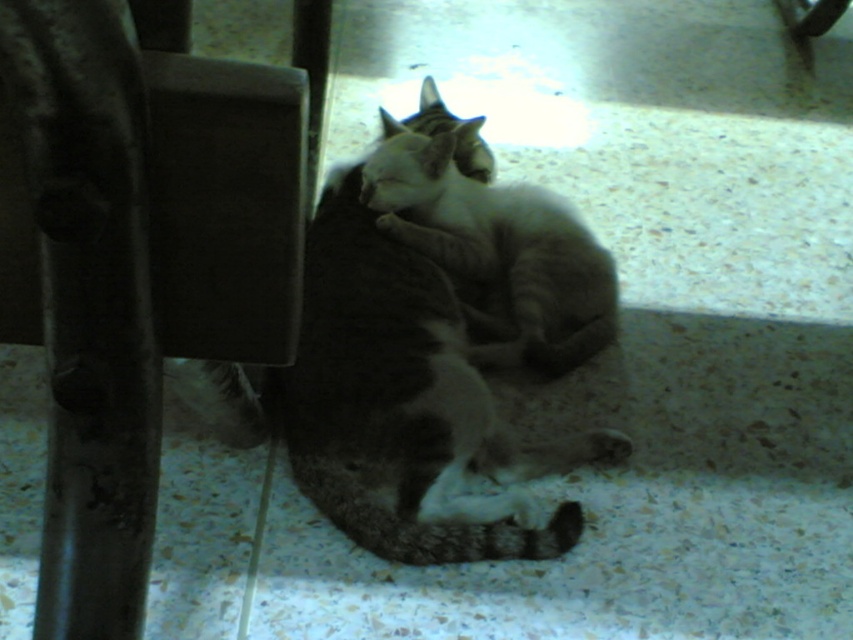
Does point (90, 561) come closer to viewer compared to point (573, 240)?

Yes, it is.

Locate an element on the screen. Image resolution: width=853 pixels, height=640 pixels. metallic dark brown chair at left is located at coordinates (134, 260).

Which is in front, point (194, 124) or point (492, 508)?

Positioned in front is point (194, 124).

From the picture: Which is below, metallic dark brown chair at left or tabby fur cat at center?

metallic dark brown chair at left

Is point (299, 209) less distant than point (466, 358)?

Yes.

Where is `metallic dark brown chair at left`? metallic dark brown chair at left is located at coordinates (134, 260).

Which of these two, tabby fur cat at center or tabby cat at center, stands taller?

Standing taller between the two is tabby fur cat at center.

Does point (498, 496) come farther from viewer compared to point (405, 193)?

That is False.

Where is `tabby fur cat at center`? This screenshot has width=853, height=640. tabby fur cat at center is located at coordinates (396, 403).